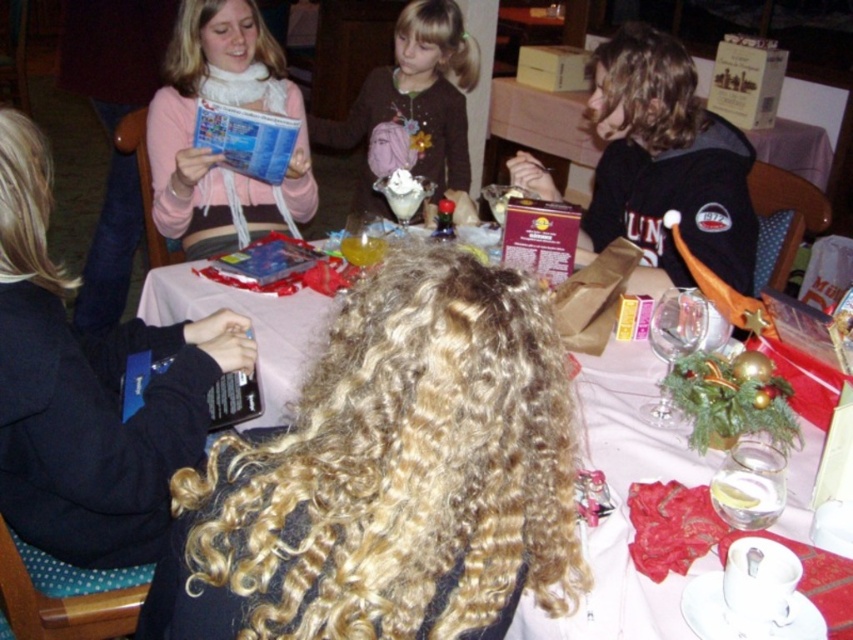
Where is `smooth white table at center`? The image size is (853, 640). smooth white table at center is located at coordinates (624, 504).

Does point (656, 429) come behind point (642, 259)?

That is False.

Is point (267, 369) closer to viewer compared to point (648, 26)?

Yes, point (267, 369) is in front of point (648, 26).

I want to click on smooth white table at center, so click(x=624, y=504).

In the scene shown: Is matte pink sweater at upper left to the right of matte pink scarf at upper left from the viewer's perspective?

Correct, you'll find matte pink sweater at upper left to the right of matte pink scarf at upper left.

Is matte pink sweater at upper left above matte pink scarf at upper left?

No, matte pink sweater at upper left is not above matte pink scarf at upper left.

Who is more distant from viewer, (138, 438) or (213, 218)?

Point (213, 218)

Locate an element on the screen. The image size is (853, 640). matte pink sweater at upper left is located at coordinates [88, 390].

Who is more forward, (102,474) or (602,179)?

Point (102,474) is in front.

Does matte pink sweater at upper left have a lesser width compared to dark brown hair at right?

Yes.

Who is more distant from viewer, (28, 365) or (635, 189)?

Point (635, 189)

Locate an element on the screen. The width and height of the screenshot is (853, 640). matte pink sweater at upper left is located at coordinates (88, 390).